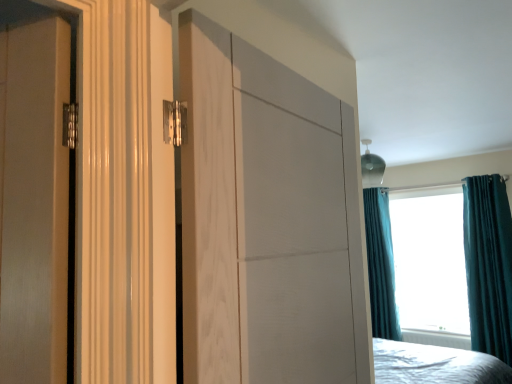
Question: In terms of width, does teal velvet curtain at upper right look wider or thinner when compared to teal velvet curtain at right, the 2th curtain viewed from the right?

Choices:
 (A) wide
 (B) thin

Answer: (A)

Question: From the image's perspective, is teal velvet curtain at upper right above or below teal velvet curtain at right, the 1th curtain positioned from the back?

Choices:
 (A) below
 (B) above

Answer: (B)

Question: Which object is positioned farthest from the teal velvet curtain at upper right?

Choices:
 (A) white wood door at center
 (B) white plastic radiator at lower center
 (C) teal velvet curtain at right, arranged as the 1th curtain when viewed from the front
 (D) teal velvet curtain at right, which is the second curtain in front-to-back order

Answer: (A)

Question: Which is nearer to the white plastic radiator at lower center?

Choices:
 (A) white wood door at center
 (B) teal velvet curtain at right, the first curtain positioned from the right
 (C) teal velvet curtain at upper right
 (D) teal velvet curtain at right, the 1th curtain positioned from the back

Answer: (C)